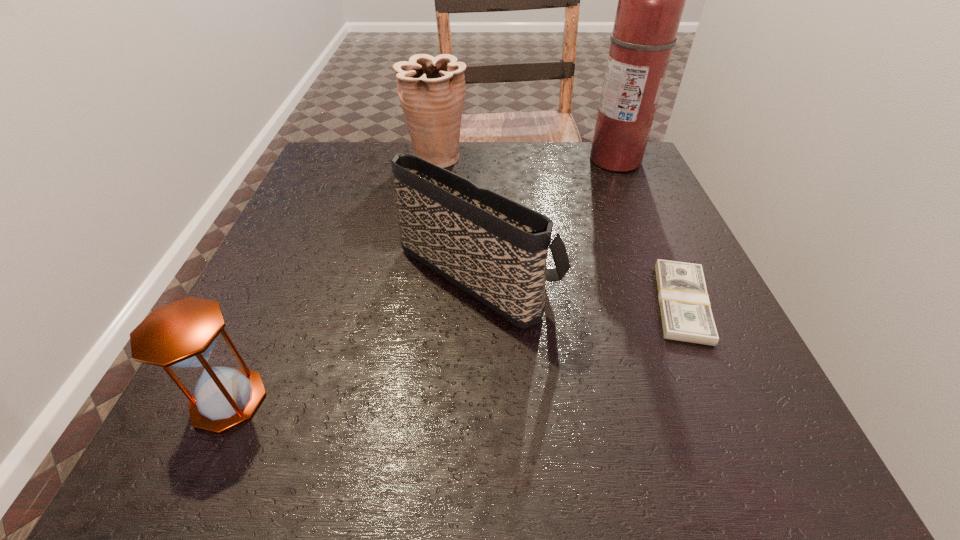
This screenshot has height=540, width=960. What are the coordinates of `object located in the far right corner section of the desktop` in the screenshot? It's located at (651, 0).

Find the location of a particular element. The width and height of the screenshot is (960, 540). blank space at the far edge is located at coordinates (487, 176).

You are a GUI agent. You are given a task and a screenshot of the screen. Output one action in this format:
    pyautogui.click(x=<x>, y=<y>)
    Task: Click on the vacant space at the near edge
    The width and height of the screenshot is (960, 540).
    Given the screenshot: What is the action you would take?
    pyautogui.click(x=496, y=429)

This screenshot has height=540, width=960. In the image, there is a desktop. What are the coordinates of `vacant space at the left edge` in the screenshot? It's located at (300, 296).

Locate an element on the screen. This screenshot has height=540, width=960. vacant space at the right edge of the desktop is located at coordinates (658, 305).

The image size is (960, 540). Identify the location of blank space at the near left corner. (201, 460).

Where is `vacant space at the far right corner of the desktop`? Image resolution: width=960 pixels, height=540 pixels. vacant space at the far right corner of the desktop is located at coordinates (574, 143).

Locate an element on the screen. Image resolution: width=960 pixels, height=540 pixels. vacant space that is in between the dollar and the leftmost object is located at coordinates (455, 352).

Identify the location of vacant area that lies between the nearest object and the tallest object. Image resolution: width=960 pixels, height=540 pixels. (422, 280).

This screenshot has height=540, width=960. Identify the location of vacant space that's between the handbag and the fourth tallest object. 353,334.